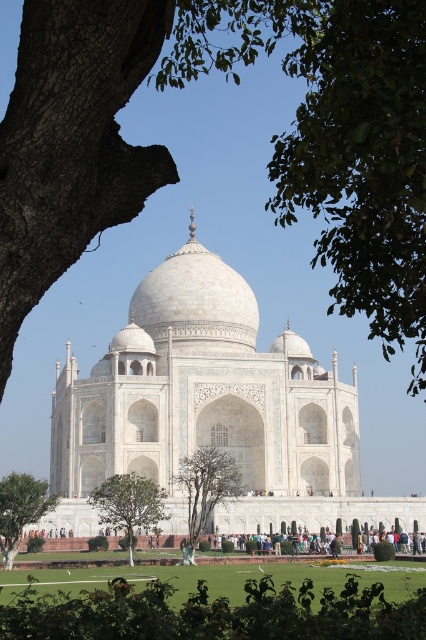
Question: Based on their relative distances, which object is nearer to the smooth bark tree at left?

Choices:
 (A) white marble taj mahal at center
 (B) green leafy tree at lower left
 (C) green leafy tree at upper center

Answer: (C)

Question: Which of the following is the farthest from the observer?

Choices:
 (A) green leafy tree at center
 (B) green leafy tree at upper center
 (C) smooth bark tree at left
 (D) green leafy tree at lower center

Answer: (A)

Question: Where is smooth bark tree at left located in relation to green leafy tree at lower left in the image?

Choices:
 (A) below
 (B) above

Answer: (B)

Question: Does white marble taj mahal at center appear on the right side of green leafy tree at lower center?

Choices:
 (A) no
 (B) yes

Answer: (B)

Question: Can you confirm if green leafy tree at upper center is thinner than green leafy tree at lower left?

Choices:
 (A) no
 (B) yes

Answer: (A)

Question: Which point appears closest to the camera in this image?

Choices:
 (A) (187, 390)
 (B) (161, 176)
 (C) (149, 513)

Answer: (B)